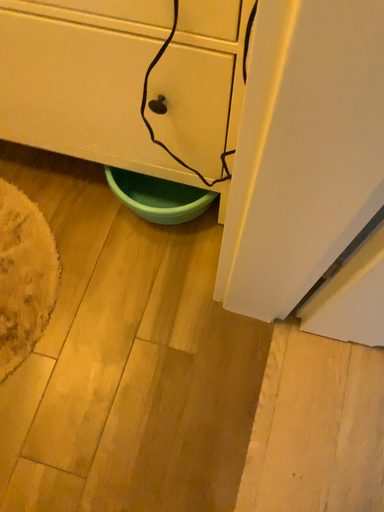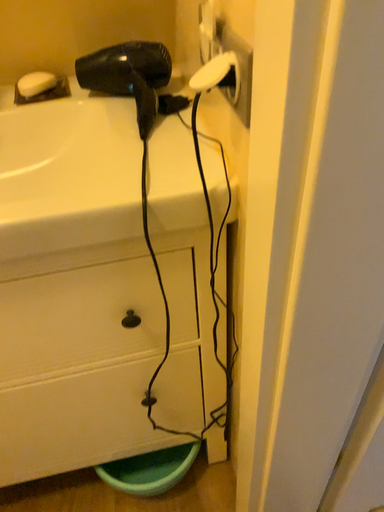
Question: How did the camera likely rotate when shooting the video?

Choices:
 (A) rotated downward
 (B) rotated upward

Answer: (B)